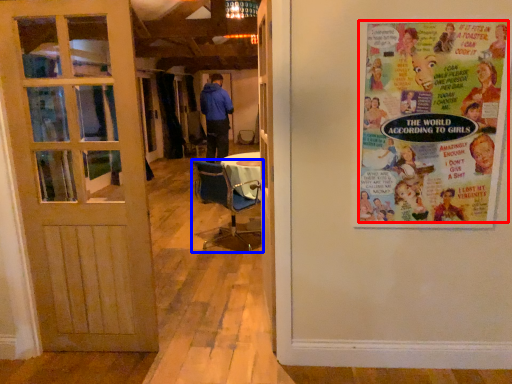
Question: Which object appears closest to the camera in this image, poster (highlighted by a red box) or chair (highlighted by a blue box)?

Choices:
 (A) poster
 (B) chair

Answer: (A)